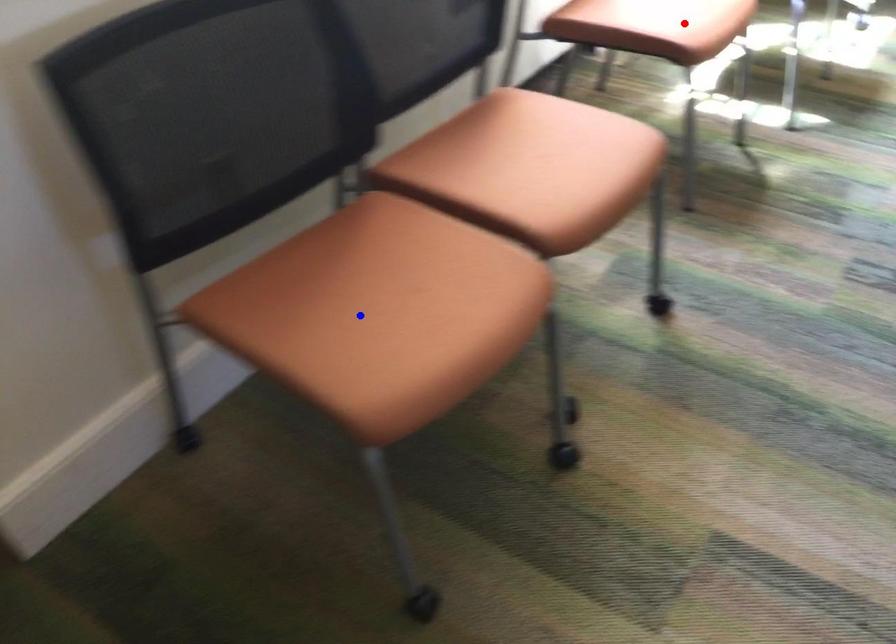
Question: In the image, two points are highlighted. Which point is nearer to the camera? Reply with the corresponding letter.

Choices:
 (A) blue point
 (B) red point

Answer: (A)